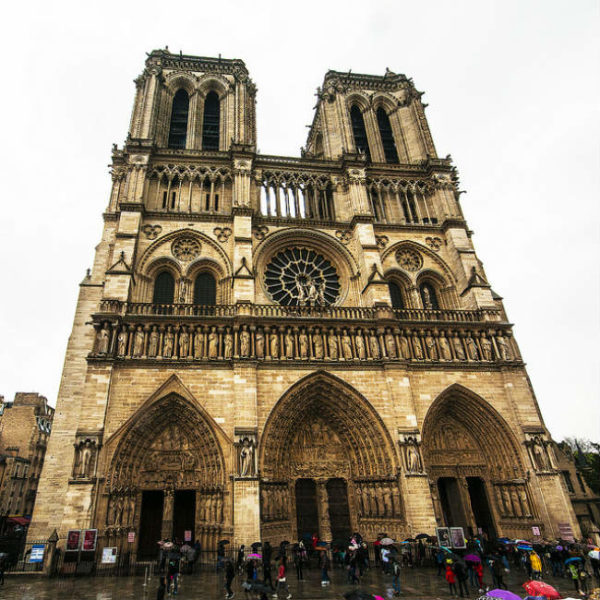
Identify the location of brown doors. (341, 505), (308, 505).